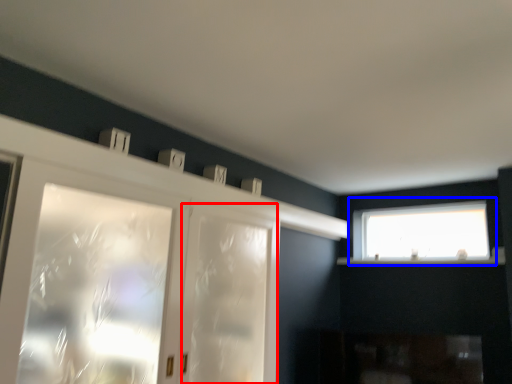
Question: Which object is further to the camera taking this photo, screen door (highlighted by a red box) or window (highlighted by a blue box)?

Choices:
 (A) screen door
 (B) window

Answer: (B)